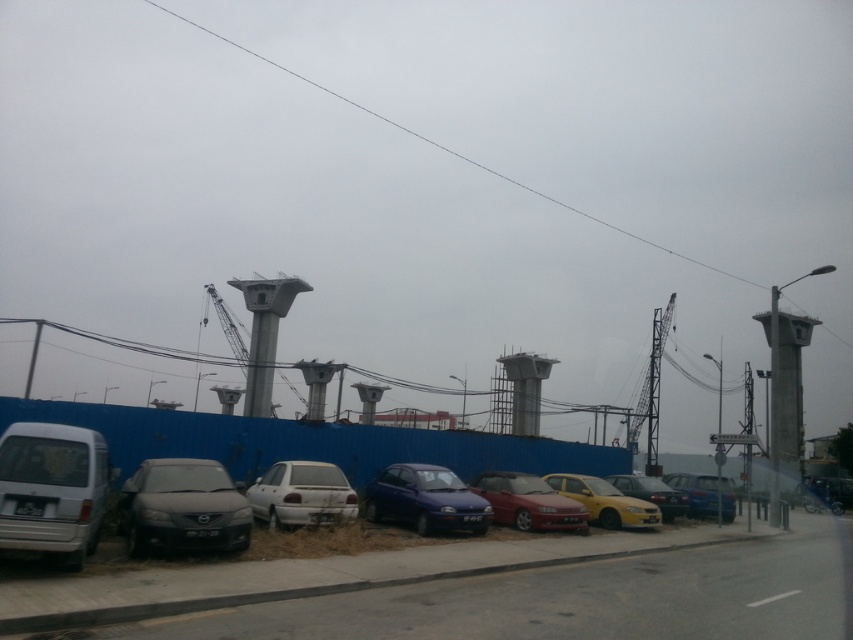
How distant is matte black car at lower left from matte blue hatchback at center?

4.65 meters

Between matte black car at lower left and matte blue hatchback at center, which one appears on the left side from the viewer's perspective?

matte black car at lower left is more to the left.

Is point (210, 497) closer to camera compared to point (456, 480)?

Yes, it is in front of point (456, 480).

In order to click on matte black car at lower left in this screenshot , I will do `click(183, 508)`.

This screenshot has height=640, width=853. I want to click on white matte sedan at center, so pos(302,493).

Which is more to the left, yellow matte car at center or metallic blue sedan at center-right?

From the viewer's perspective, yellow matte car at center appears more on the left side.

Can you confirm if yellow matte car at center is positioned to the right of metallic blue sedan at center-right?

Incorrect, yellow matte car at center is not on the right side of metallic blue sedan at center-right.

Find the location of a particular element. The width and height of the screenshot is (853, 640). yellow matte car at center is located at coordinates (605, 500).

Where is `yellow matte car at center`? This screenshot has height=640, width=853. yellow matte car at center is located at coordinates (605, 500).